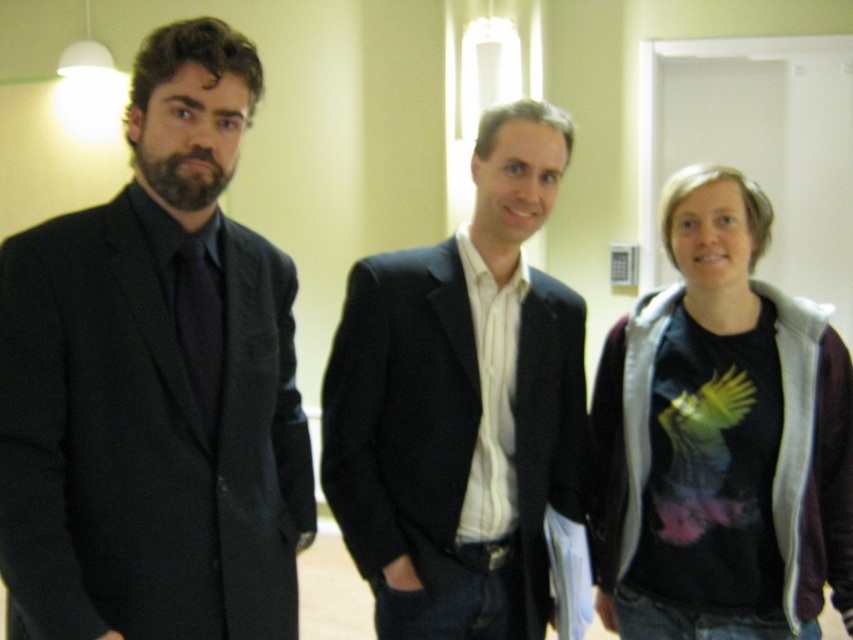
You are standing in the hallway and need to locate the matte black suit at left. According to the coordinates provided, where exactly would you find it?

The matte black suit at left is located at the coordinates point (155, 384).

Looking at this image, you are a security guard in the hallway and need to check the security keypad near the door. You see the matte black suit at left and the black matte suit at center. Which one is closer to the security keypad?

The matte black suit at left is closer to the security keypad because it is located above the black matte suit at center, which implies it is positioned higher and nearer to the door area.